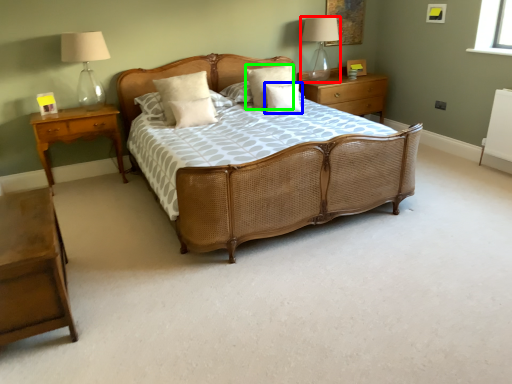
Question: Considering the real-world distances, which object is farthest from table lamp (highlighted by a red box)? pillow (highlighted by a blue box) or pillow (highlighted by a green box)?

Choices:
 (A) pillow
 (B) pillow

Answer: (A)